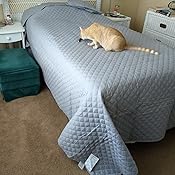
The height and width of the screenshot is (175, 175). I want to click on dresser, so click(x=150, y=26).